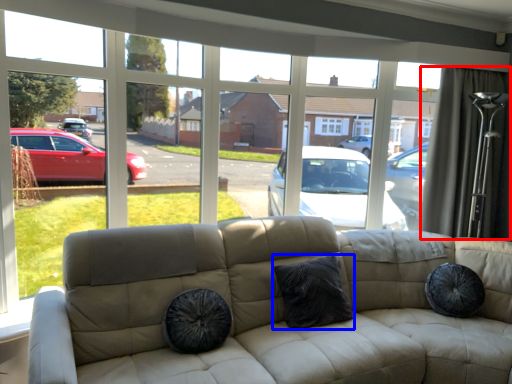
Question: Which of the following is the closest to the observer, curtain (highlighted by a red box) or pillow (highlighted by a blue box)?

Choices:
 (A) curtain
 (B) pillow

Answer: (B)